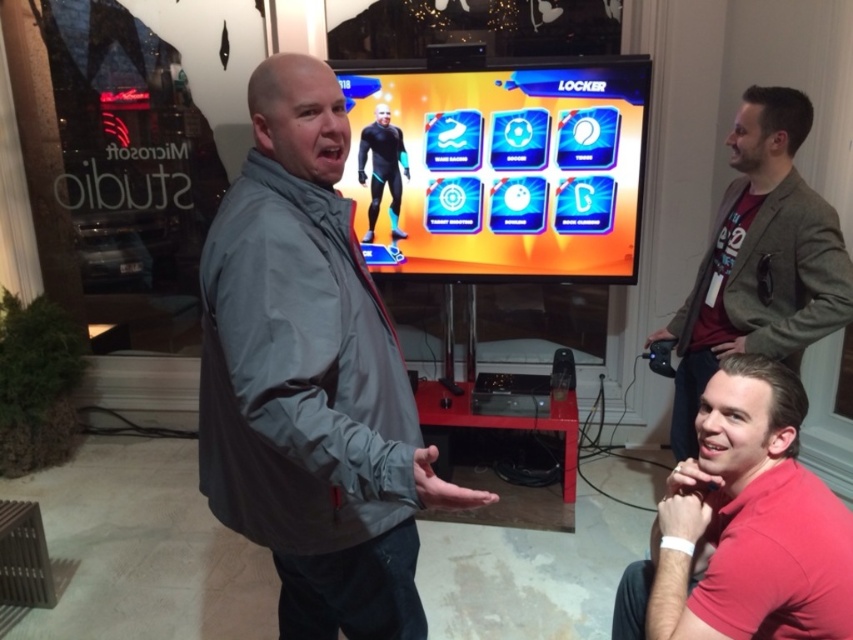
You are a photographer standing in front of the scene and want to take a photo of the gray matte jacket at center and the green textured blazer at upper right. Which object will appear larger in the photo?

The gray matte jacket at center will appear larger in the photo because it is closer to the viewer than the green textured blazer at upper right.

Please provide the exact coordinates of the green textured blazer at upper right in the image.

The green textured blazer at upper right is located at coordinates point (759,260).